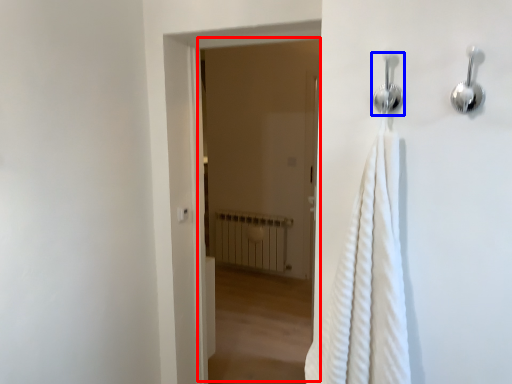
Question: Which point is closer to the camera, screen door (highlighted by a red box) or shower (highlighted by a blue box)?

Choices:
 (A) screen door
 (B) shower

Answer: (B)